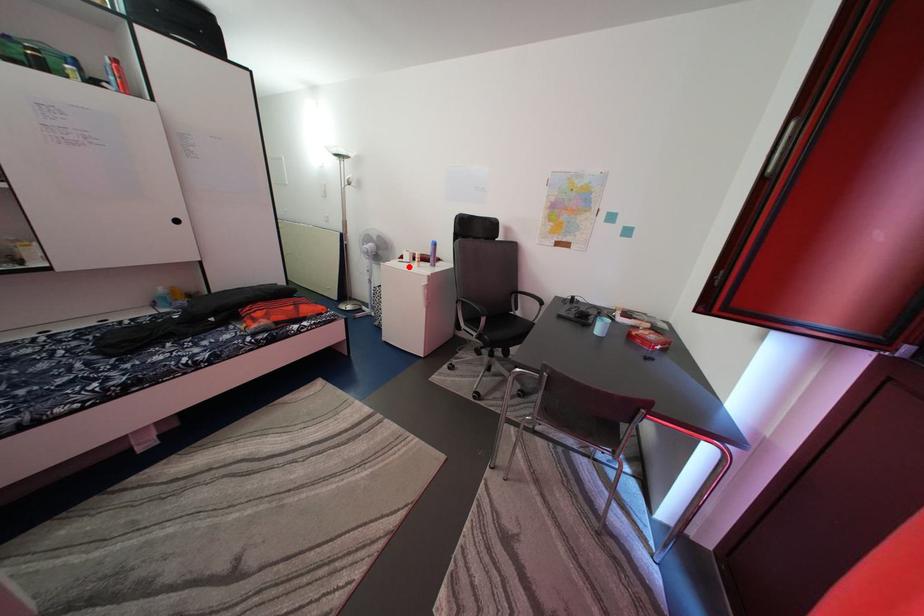
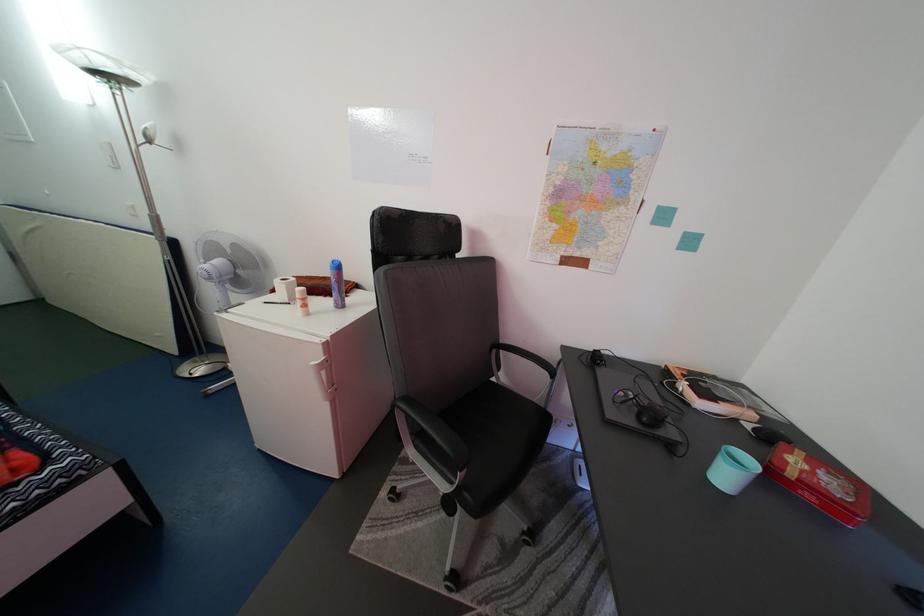
The point at the highlighted location is marked in the first image. Where is the corresponding point in the second image?

(280, 304)